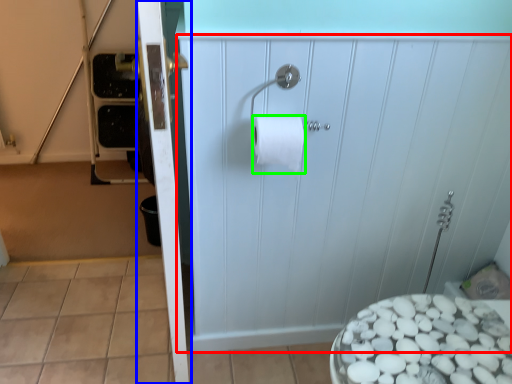
Question: Which is nearer to the screen door (highlighted by a red box)? screen door (highlighted by a blue box) or toilet paper (highlighted by a green box).

Choices:
 (A) screen door
 (B) toilet paper

Answer: (B)